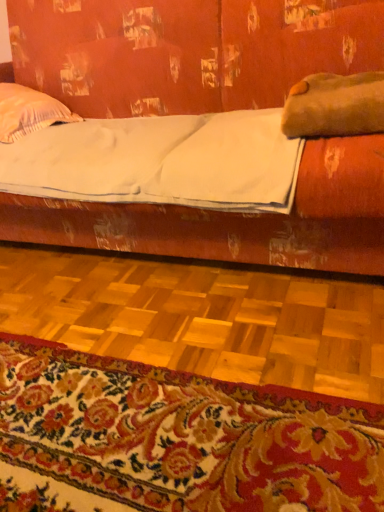
Question: Is white striped pillow at upper left, which is the second pillow in front-to-back order, thinner than matte wood studio couch at upper center?

Choices:
 (A) yes
 (B) no

Answer: (A)

Question: Is white striped pillow at upper left, the first pillow when ordered from left to right, completely or partially outside of matte wood studio couch at upper center?

Choices:
 (A) yes
 (B) no

Answer: (B)

Question: Is matte wood studio couch at upper center at the back of white striped pillow at upper left, which ranks as the 2th pillow in right-to-left order?

Choices:
 (A) no
 (B) yes

Answer: (B)

Question: Does white striped pillow at upper left, the first pillow when ordered from left to right, lie in front of matte wood studio couch at upper center?

Choices:
 (A) no
 (B) yes

Answer: (A)

Question: Can you confirm if white striped pillow at upper left, marked as the first pillow in a back-to-front arrangement, is positioned to the left of matte wood studio couch at upper center?

Choices:
 (A) no
 (B) yes

Answer: (B)

Question: Would you say brown fuzzy pillow at upper right, acting as the 2th pillow starting from the left, is to the left or to the right of white matte sheet at center in the picture?

Choices:
 (A) left
 (B) right

Answer: (B)

Question: From the image's perspective, is brown fuzzy pillow at upper right, placed as the second pillow when sorted from back to front, located above or below white matte sheet at center?

Choices:
 (A) above
 (B) below

Answer: (A)

Question: Is point (375, 110) positioned closer to the camera than point (208, 160)?

Choices:
 (A) farther
 (B) closer

Answer: (B)

Question: Choose the correct answer: Is brown fuzzy pillow at upper right, positioned as the first pillow in right-to-left order, inside white matte sheet at center or outside it?

Choices:
 (A) inside
 (B) outside

Answer: (B)

Question: Choose the correct answer: Is white matte sheet at center inside floral carpet at lower center or outside it?

Choices:
 (A) outside
 (B) inside

Answer: (A)

Question: From the image's perspective, is white matte sheet at center positioned above or below floral carpet at lower center?

Choices:
 (A) above
 (B) below

Answer: (A)

Question: Relative to floral carpet at lower center, is white matte sheet at center in front or behind?

Choices:
 (A) behind
 (B) front

Answer: (A)

Question: In terms of width, does white matte sheet at center look wider or thinner when compared to floral carpet at lower center?

Choices:
 (A) thin
 (B) wide

Answer: (B)

Question: Is point (72, 508) positioned closer to the camera than point (3, 183)?

Choices:
 (A) closer
 (B) farther

Answer: (A)

Question: Is floral carpet at lower center wider or thinner than white matte sheet at center?

Choices:
 (A) wide
 (B) thin

Answer: (B)